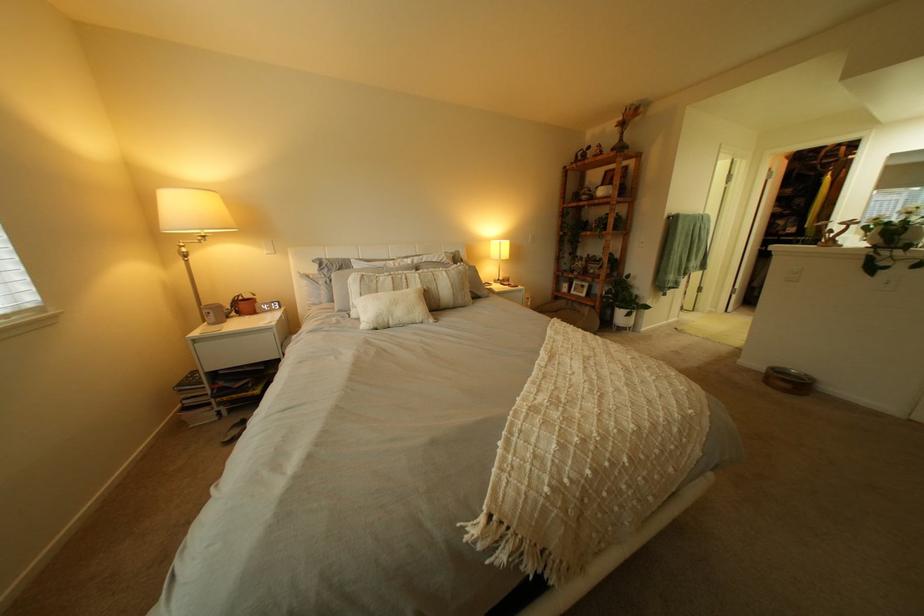
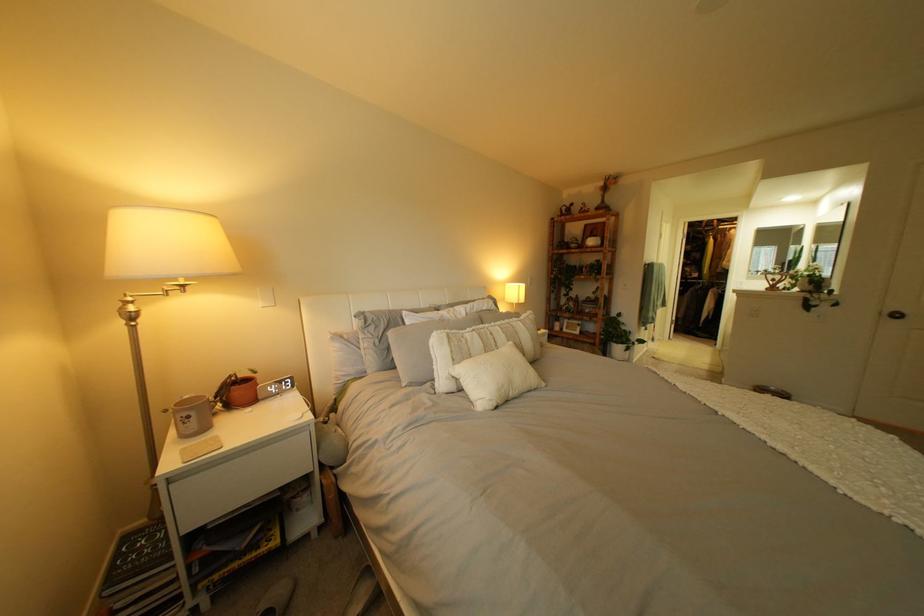
The point at [247,309] is marked in the first image. Where is the corresponding point in the second image?

(232, 399)